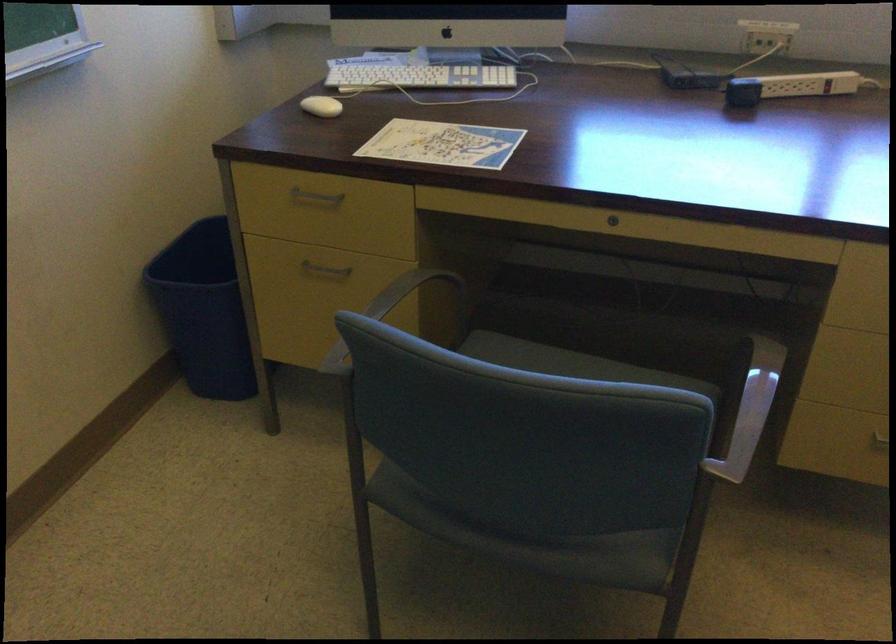
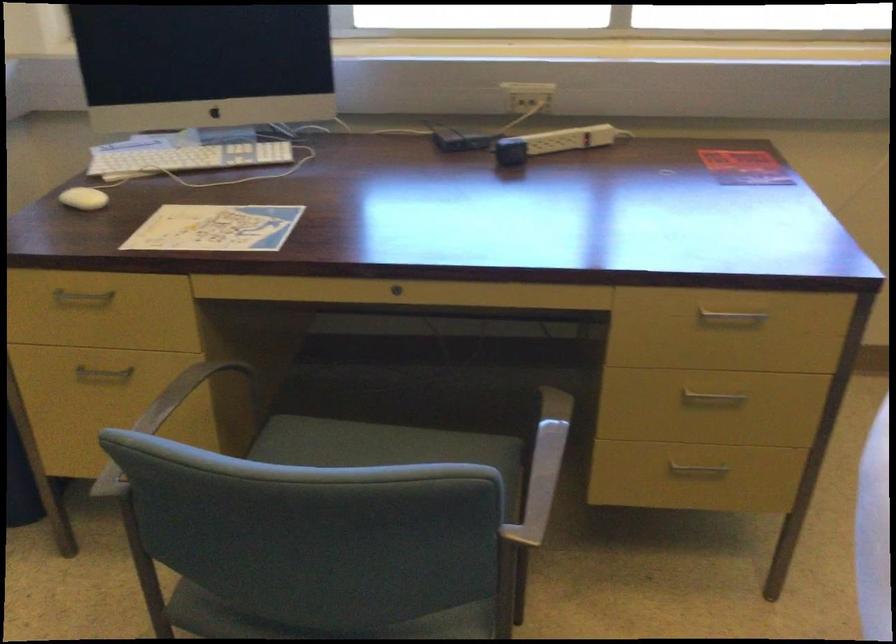
Question: Which direction would the cameraman need to move to produce the second image? Reply with the corresponding letter.

Choices:
 (A) Left
 (B) Right
 (C) Forward
 (D) Backward

Answer: (B)